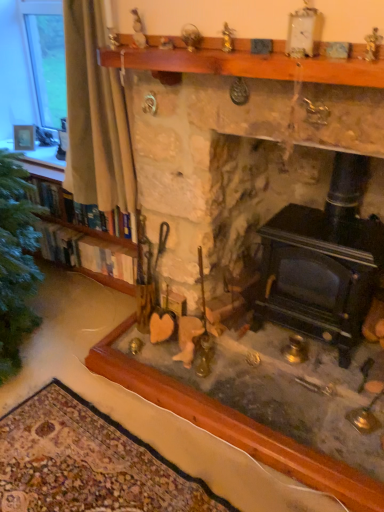
Question: Can you confirm if stone fireplace at center is smaller than black cast iron wood burning stove at lower right?

Choices:
 (A) no
 (B) yes

Answer: (A)

Question: Considering the relative sizes of stone fireplace at center and black cast iron wood burning stove at lower right in the image provided, is stone fireplace at center bigger than black cast iron wood burning stove at lower right?

Choices:
 (A) no
 (B) yes

Answer: (B)

Question: From the image's perspective, is stone fireplace at center located beneath black cast iron wood burning stove at lower right?

Choices:
 (A) no
 (B) yes

Answer: (A)

Question: From the image's perspective, would you say stone fireplace at center is positioned over black cast iron wood burning stove at lower right?

Choices:
 (A) yes
 (B) no

Answer: (A)

Question: Considering the relative sizes of stone fireplace at center and black cast iron wood burning stove at lower right in the image provided, is stone fireplace at center shorter than black cast iron wood burning stove at lower right?

Choices:
 (A) no
 (B) yes

Answer: (A)

Question: Can you confirm if stone fireplace at center is positioned to the right of black cast iron wood burning stove at lower right?

Choices:
 (A) yes
 (B) no

Answer: (B)

Question: Does wooden mantle at upper center have a smaller size compared to white fabric curtain at left?

Choices:
 (A) yes
 (B) no

Answer: (A)

Question: Is wooden mantle at upper center positioned beyond the bounds of white fabric curtain at left?

Choices:
 (A) yes
 (B) no

Answer: (A)

Question: From a real-world perspective, does wooden mantle at upper center sit lower than white fabric curtain at left?

Choices:
 (A) no
 (B) yes

Answer: (A)

Question: Does wooden mantle at upper center have a lesser height compared to white fabric curtain at left?

Choices:
 (A) yes
 (B) no

Answer: (A)

Question: Is wooden mantle at upper center touching white fabric curtain at left?

Choices:
 (A) no
 (B) yes

Answer: (A)

Question: Is wooden mantle at upper center facing away from white fabric curtain at left?

Choices:
 (A) no
 (B) yes

Answer: (A)

Question: From the image's perspective, is white fabric curtain at left below stone fireplace at center?

Choices:
 (A) yes
 (B) no

Answer: (B)